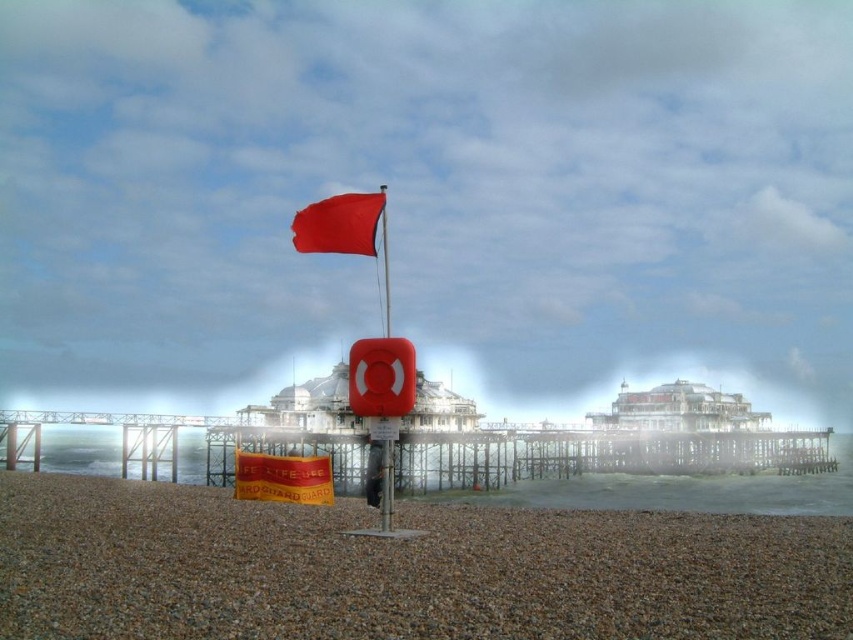
You are a photographer trying to capture the entire scene in one shot. Since the smooth pebble beach at center and the matte red flag at center are both important elements, which one should you focus on to ensure both are visible without cropping?

The smooth pebble beach at center is smaller than the matte red flag at center, so focusing on the matte red flag at center will allow the smaller beach area to fit into the frame more easily.

Looking at this image, you are standing on the smooth pebble beach at center and want to reach the smooth plastic flag at center. Which direction should you walk to get closer to the flag?

The smooth pebble beach at center is positioned on the right side of the smooth plastic flag at center, so you should walk to the left to move towards the flag.

You are designing a banner for a beach safety campaign and want to ensure it can be seen clearly from a distance. Which of the two flags, the matte red flag at center or the smooth plastic flag at center, should you choose based on their visibility potential?

The matte red flag at center has a larger width than the smooth plastic flag at center, making it more visible from a distance due to its greater size.